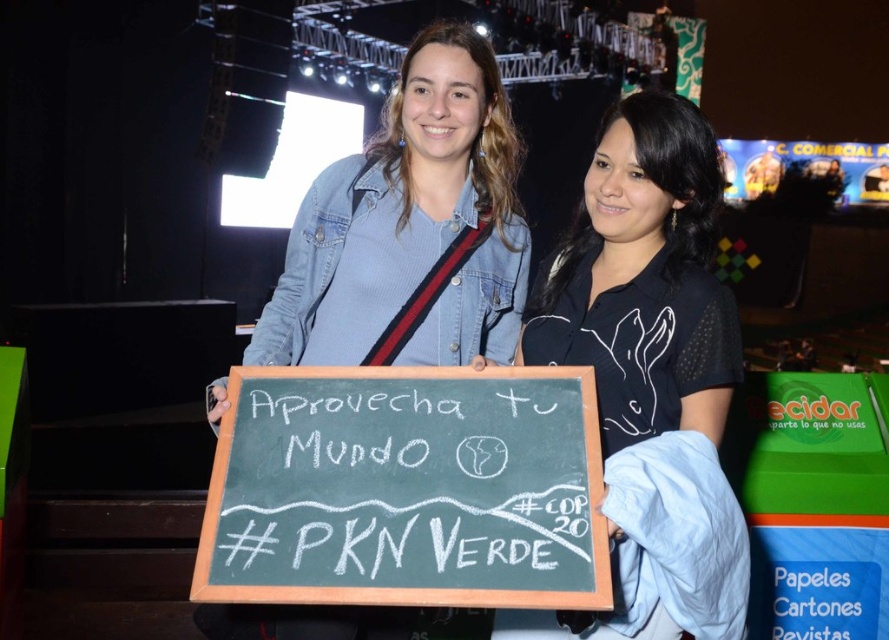
Who is taller, black chalkboard at center or denim jacket at center?

With more height is denim jacket at center.

What do you see at coordinates (406, 490) in the screenshot? This screenshot has width=889, height=640. I see `black chalkboard at center` at bounding box center [406, 490].

Measure the distance between black chalkboard at center and camera.

A distance of 4.51 feet exists between black chalkboard at center and camera.

You are a GUI agent. You are given a task and a screenshot of the screen. Output one action in this format:
    pyautogui.click(x=<x>, y=<y>)
    Task: Click on the black chalkboard at center
    Image resolution: width=889 pixels, height=640 pixels.
    Given the screenshot: What is the action you would take?
    pyautogui.click(x=406, y=490)

Can you confirm if black matte shirt at center is thinner than denim jacket at center?

Correct, black matte shirt at center's width is less than denim jacket at center's.

Does black matte shirt at center appear under denim jacket at center?

Yes.

Identify the location of black matte shirt at center. The width and height of the screenshot is (889, 640). (650, 378).

Identify the location of black matte shirt at center. (650, 378).

Does black chalkboard at center appear on the left side of black matte shirt at center?

Indeed, black chalkboard at center is positioned on the left side of black matte shirt at center.

From the picture: Is black chalkboard at center positioned in front of black matte shirt at center?

Yes.

Locate an element on the screen. black chalkboard at center is located at coordinates (406, 490).

This screenshot has height=640, width=889. I want to click on black chalkboard at center, so click(x=406, y=490).